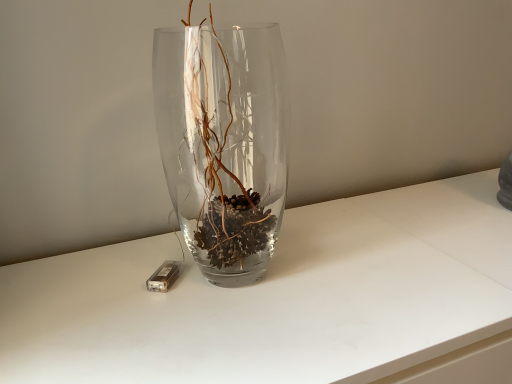
Question: Is transparent glass vase at center far away from matte brown rectangular at left?

Choices:
 (A) yes
 (B) no

Answer: (B)

Question: Does transparent glass vase at center have a greater width compared to matte brown rectangular at left?

Choices:
 (A) no
 (B) yes

Answer: (B)

Question: Is transparent glass vase at center positioned with its back to matte brown rectangular at left?

Choices:
 (A) no
 (B) yes

Answer: (A)

Question: Is transparent glass vase at center at the right side of matte brown rectangular at left?

Choices:
 (A) yes
 (B) no

Answer: (A)

Question: Is transparent glass vase at center oriented towards matte brown rectangular at left?

Choices:
 (A) yes
 (B) no

Answer: (B)

Question: Does transparent glass vase at center come behind matte brown rectangular at left?

Choices:
 (A) no
 (B) yes

Answer: (A)

Question: Is matte brown rectangular at left far from transparent glass vase at center?

Choices:
 (A) no
 (B) yes

Answer: (A)

Question: Is matte brown rectangular at left thinner than transparent glass vase at center?

Choices:
 (A) no
 (B) yes

Answer: (B)

Question: Can we say matte brown rectangular at left lies outside transparent glass vase at center?

Choices:
 (A) yes
 (B) no

Answer: (A)

Question: From a real-world perspective, is matte brown rectangular at left positioned over transparent glass vase at center based on gravity?

Choices:
 (A) no
 (B) yes

Answer: (A)

Question: Is transparent glass vase at center at the back of matte brown rectangular at left?

Choices:
 (A) yes
 (B) no

Answer: (B)

Question: Considering the relative sizes of matte brown rectangular at left and transparent glass vase at center in the image provided, is matte brown rectangular at left bigger than transparent glass vase at center?

Choices:
 (A) yes
 (B) no

Answer: (B)

Question: In the image, is transparent glass vase at center positioned in front of or behind matte brown rectangular at left?

Choices:
 (A) behind
 (B) front

Answer: (B)